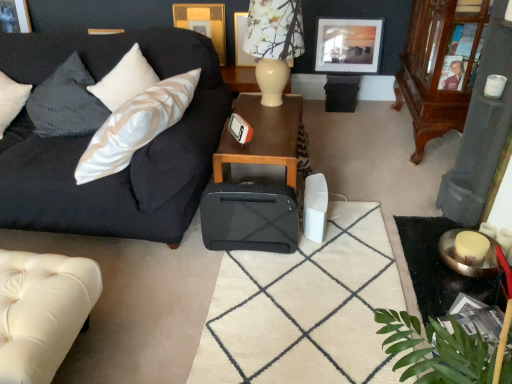
What are the coordinates of `vacant point above black fabric suitcase at center (from a real-world perspective)` in the screenshot? It's located at (300, 292).